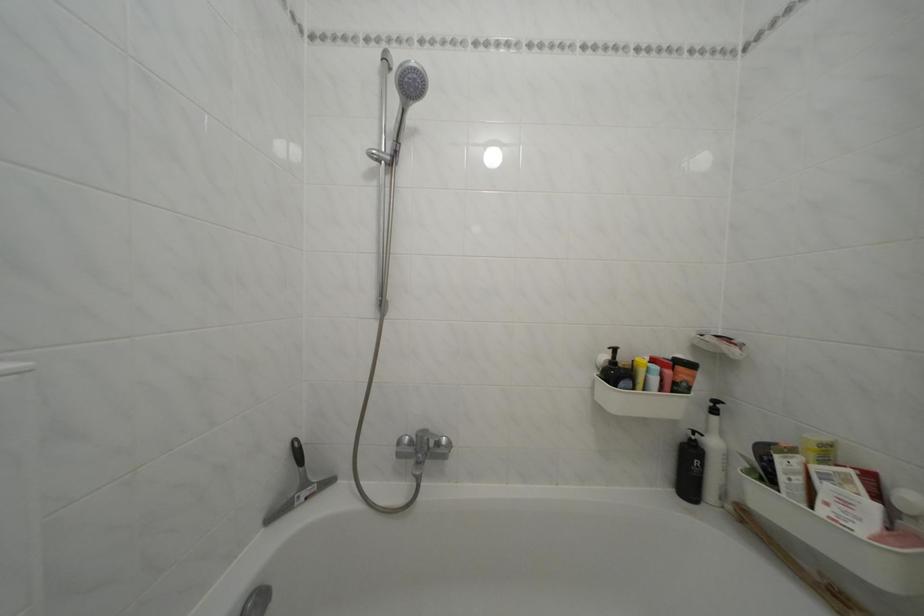
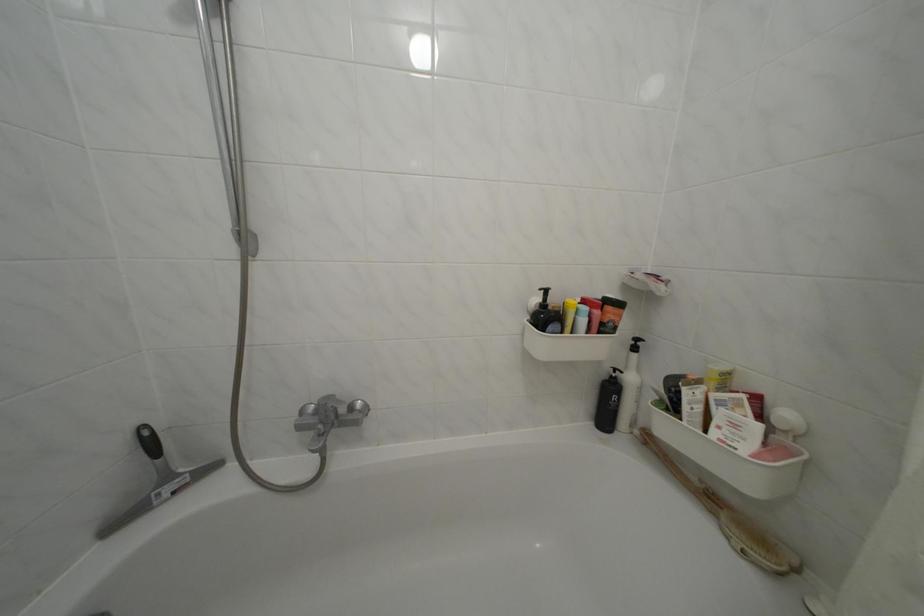
In the second image, find the point that corresponds to (314,491) in the first image.

(176, 484)